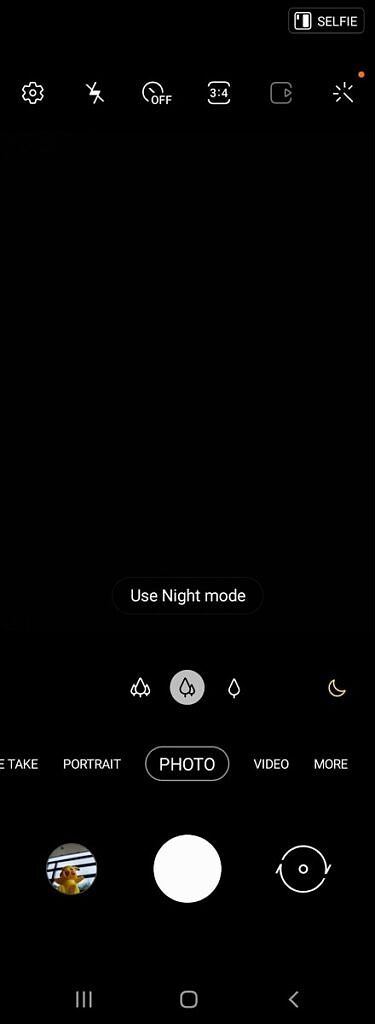
The width and height of the screenshot is (375, 1024). I want to click on off switch, so click(156, 99).